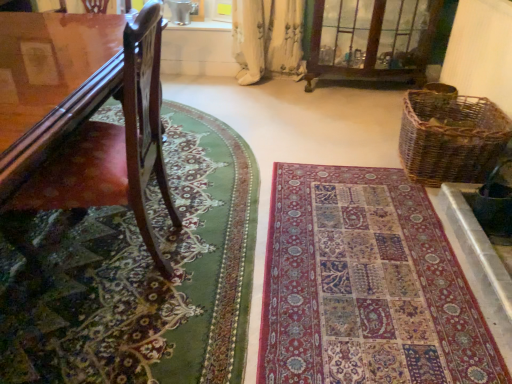
What do you see at coordinates (366, 286) in the screenshot? I see `multicolored woven rug at center, marked as the 1th mat in a right-to-left arrangement` at bounding box center [366, 286].

This screenshot has height=384, width=512. Find the location of `shiny brown wood chair at left`. shiny brown wood chair at left is located at coordinates (125, 123).

Describe the element at coordinates (371, 39) in the screenshot. The image size is (512, 384). I see `clear glass cabinet at upper center` at that location.

Identify the location of green woolen rug at lower left, marked as the 1th mat in a left-to-right arrangement. The width and height of the screenshot is (512, 384). (137, 275).

Locate an element on the screen. The height and width of the screenshot is (384, 512). multicolored woven rug at center, marked as the 1th mat in a right-to-left arrangement is located at coordinates (366, 286).

Would you say clear glass cabinet at upper center is inside or outside green woolen rug at lower left, marked as the 1th mat in a left-to-right arrangement?

clear glass cabinet at upper center is outside green woolen rug at lower left, marked as the 1th mat in a left-to-right arrangement.

Considering the positions of objects clear glass cabinet at upper center and green woolen rug at lower left, acting as the second mat starting from the right, in the image provided, who is more to the left, clear glass cabinet at upper center or green woolen rug at lower left, acting as the second mat starting from the right,?

From the viewer's perspective, green woolen rug at lower left, acting as the second mat starting from the right, appears more on the left side.

From the image's perspective, is clear glass cabinet at upper center on green woolen rug at lower left, marked as the 1th mat in a left-to-right arrangement?

Yes.

Which point is more distant from viewer, (424, 30) or (26, 171)?

Point (424, 30)

Are clear glass cabinet at upper center and shiny brown wood chair at left beside each other?

There is a gap between clear glass cabinet at upper center and shiny brown wood chair at left.

Is clear glass cabinet at upper center facing towards shiny brown wood chair at left?

No, clear glass cabinet at upper center is not facing towards shiny brown wood chair at left.

Are multicolored woven rug at center, marked as the 1th mat in a right-to-left arrangement, and green woolen rug at lower left, marked as the 1th mat in a left-to-right arrangement, far apart?

multicolored woven rug at center, marked as the 1th mat in a right-to-left arrangement, is actually quite close to green woolen rug at lower left, marked as the 1th mat in a left-to-right arrangement.

Is multicolored woven rug at center, the 2th mat when ordered from left to right, facing towards green woolen rug at lower left, acting as the second mat starting from the right?

Yes, multicolored woven rug at center, the 2th mat when ordered from left to right, is aimed at green woolen rug at lower left, acting as the second mat starting from the right.

How far apart are multicolored woven rug at center, marked as the 1th mat in a right-to-left arrangement, and green woolen rug at lower left, marked as the 1th mat in a left-to-right arrangement?

A distance of 19.74 inches exists between multicolored woven rug at center, marked as the 1th mat in a right-to-left arrangement, and green woolen rug at lower left, marked as the 1th mat in a left-to-right arrangement.

Does point (424, 171) appear closer or farther from the camera than point (152, 241)?

Point (424, 171) is farther from the camera than point (152, 241).

Who is smaller, woven brown picnic basket at right or shiny brown wood chair at left?

With smaller size is woven brown picnic basket at right.

From a real-world perspective, is woven brown picnic basket at right under shiny brown wood chair at left?

Yes, from a real-world perspective, woven brown picnic basket at right is beneath shiny brown wood chair at left.

Consider the image. From the image's perspective, is woven brown picnic basket at right above or below shiny brown wood chair at left?

From the image's perspective, woven brown picnic basket at right appears above shiny brown wood chair at left.

How different are the orientations of shiny brown wood chair at left and woven brown picnic basket at right in degrees?

7.12 degrees separate the facing orientations of shiny brown wood chair at left and woven brown picnic basket at right.

Which object is thinner, shiny brown wood chair at left or woven brown picnic basket at right?

woven brown picnic basket at right is thinner.

From a real-world perspective, is shiny brown wood chair at left positioned over woven brown picnic basket at right based on gravity?

Yes, from a real-world perspective, shiny brown wood chair at left is over woven brown picnic basket at right

Is shiny brown wood chair at left facing away from woven brown picnic basket at right?

No, shiny brown wood chair at left is not facing the opposite direction of woven brown picnic basket at right.

The width and height of the screenshot is (512, 384). Identify the location of the 2nd mat in front of the clear glass cabinet at upper center. (137, 275).

Is green woolen rug at lower left, marked as the 1th mat in a left-to-right arrangement, placed right next to clear glass cabinet at upper center?

green woolen rug at lower left, marked as the 1th mat in a left-to-right arrangement, and clear glass cabinet at upper center are not in contact.

Does green woolen rug at lower left, marked as the 1th mat in a left-to-right arrangement, have a lesser width compared to clear glass cabinet at upper center?

No.

Looking at this image, is green woolen rug at lower left, marked as the 1th mat in a left-to-right arrangement, turned away from clear glass cabinet at upper center?

No, green woolen rug at lower left, marked as the 1th mat in a left-to-right arrangement, is not facing away from clear glass cabinet at upper center.

Is shiny brown wood chair at left further to the viewer compared to clear glass cabinet at upper center?

That is False.

From a real-world perspective, between shiny brown wood chair at left and clear glass cabinet at upper center, who is vertically higher?

In real-world perspective, shiny brown wood chair at left is above.

Is shiny brown wood chair at left looking in the opposite direction of clear glass cabinet at upper center?

shiny brown wood chair at left does not have its back to clear glass cabinet at upper center.

This screenshot has height=384, width=512. Identify the location of the 1st mat located beneath the clear glass cabinet at upper center (from a real-world perspective). (137, 275).

Image resolution: width=512 pixels, height=384 pixels. Find the location of `bay window on the right side of shiny brown wood chair at left`. bay window on the right side of shiny brown wood chair at left is located at coordinates (371, 39).

Estimate the real-world distances between objects in this image. Which object is closer to green woolen rug at lower left, acting as the second mat starting from the right, shiny brown wood chair at left or multicolored woven rug at center, marked as the 1th mat in a right-to-left arrangement?

shiny brown wood chair at left.

Consider the image. Looking at the image, which one is located further to green woolen rug at lower left, acting as the second mat starting from the right, clear glass cabinet at upper center or shiny brown wood chair at left?

The object further to green woolen rug at lower left, acting as the second mat starting from the right, is clear glass cabinet at upper center.

Based on their spatial positions, is shiny brown wood chair at left or woven brown picnic basket at right closer to multicolored woven rug at center, marked as the 1th mat in a right-to-left arrangement?

woven brown picnic basket at right.

Considering their positions, is woven brown picnic basket at right positioned closer to shiny brown wood chair at left than green woolen rug at lower left, acting as the second mat starting from the right?

green woolen rug at lower left, acting as the second mat starting from the right, is positioned closer to the anchor shiny brown wood chair at left.

Looking at this image, looking at the image, which one is located further to clear glass cabinet at upper center, green woolen rug at lower left, acting as the second mat starting from the right, or woven brown picnic basket at right?

The object further to clear glass cabinet at upper center is green woolen rug at lower left, acting as the second mat starting from the right.

Based on their spatial positions, is clear glass cabinet at upper center or woven brown picnic basket at right closer to green woolen rug at lower left, acting as the second mat starting from the right?

woven brown picnic basket at right is positioned closer to the anchor green woolen rug at lower left, acting as the second mat starting from the right.

Based on their spatial positions, is green woolen rug at lower left, acting as the second mat starting from the right, or clear glass cabinet at upper center closer to shiny brown wood chair at left?

Among the two, green woolen rug at lower left, acting as the second mat starting from the right, is located nearer to shiny brown wood chair at left.

When comparing their distances from shiny brown wood chair at left, does woven brown picnic basket at right or clear glass cabinet at upper center seem further?

Based on the image, clear glass cabinet at upper center appears to be further to shiny brown wood chair at left.

Identify the location of furniture between green woolen rug at lower left, marked as the 1th mat in a left-to-right arrangement, and woven brown picnic basket at right, in the horizontal direction. (125, 123).

Identify the location of mat located between green woolen rug at lower left, marked as the 1th mat in a left-to-right arrangement, and clear glass cabinet at upper center in the depth direction. coord(366,286).

You are a GUI agent. You are given a task and a screenshot of the screen. Output one action in this format:
    pyautogui.click(x=<x>, y=<y>)
    Task: Click on the picnic basket between shiny brown wood chair at left and clear glass cabinet at upper center from front to back
    The width and height of the screenshot is (512, 384).
    Given the screenshot: What is the action you would take?
    point(451,137)

This screenshot has width=512, height=384. What are the coordinates of `bay window between green woolen rug at lower left, marked as the 1th mat in a left-to-right arrangement, and woven brown picnic basket at right from left to right` in the screenshot? It's located at (371, 39).